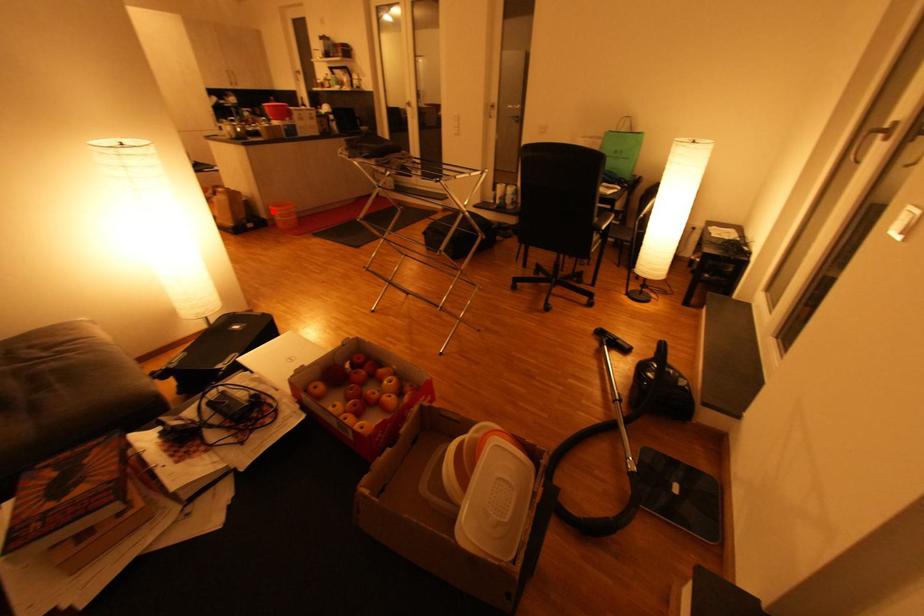
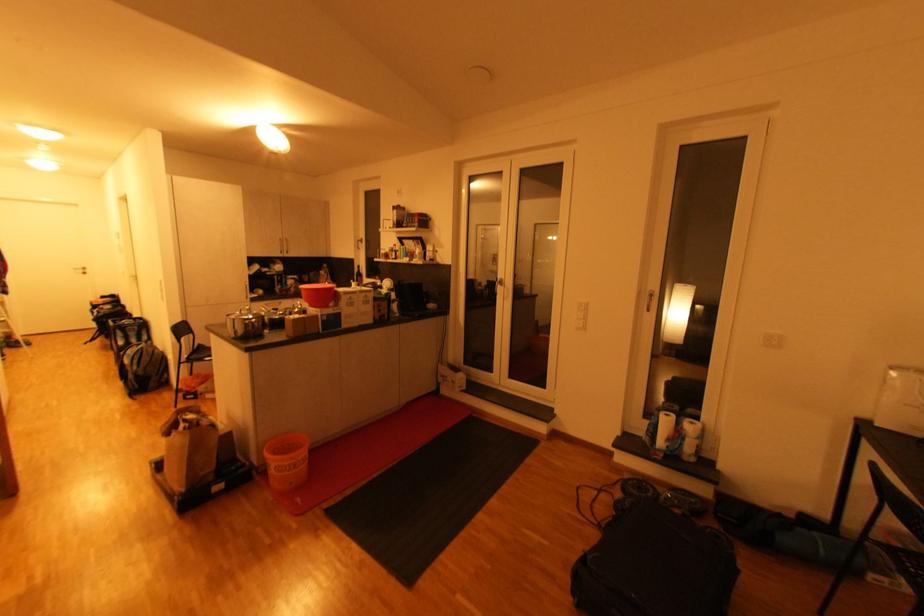
Find the pixel in the second image that matches the highlighted location in the first image.

(265, 455)